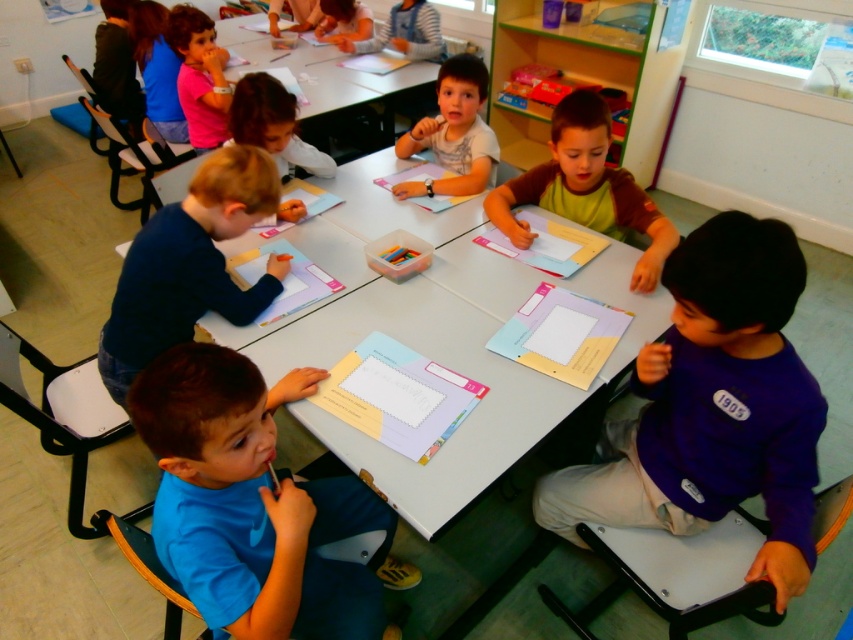
Is purple matte shirt at lower right positioned before blue matte shirt at lower left?

That is False.

Does point (761, 461) lie in front of point (347, 614)?

Yes, point (761, 461) is in front of point (347, 614).

Who is more distant from viewer, (642,448) or (190,417)?

Point (642,448)

Where is `purple matte shirt at lower right`? purple matte shirt at lower right is located at coordinates (712, 406).

The image size is (853, 640). What do you see at coordinates (712, 406) in the screenshot?
I see `purple matte shirt at lower right` at bounding box center [712, 406].

Is purple matte shirt at lower right to the right of smooth pink shirt at center from the viewer's perspective?

Correct, you'll find purple matte shirt at lower right to the right of smooth pink shirt at center.

At what (x,y) coordinates should I click in order to perform the action: click on purple matte shirt at lower right. Please return your answer as a coordinate pair (x, y). The height and width of the screenshot is (640, 853). Looking at the image, I should click on (712, 406).

Who is higher up, dark blue shirt at center or green fabric shirt at center?

Positioned higher is green fabric shirt at center.

Is point (141, 330) positioned in front of point (636, 278)?

That is True.

Does point (228, 179) lie behind point (616, 228)?

No, it is in front of (616, 228).

Identify the location of dark blue shirt at center. The image size is (853, 640). (189, 266).